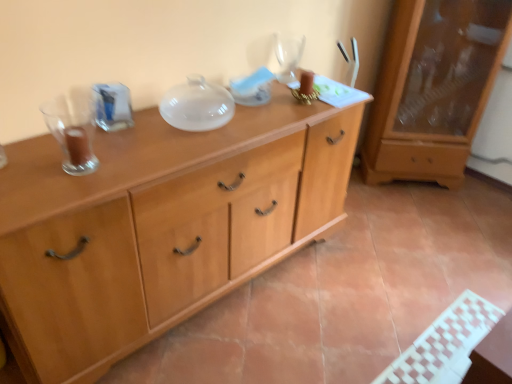
Question: From the image's perspective, would you say light wood cabinet at center is positioned over transparent glass wine glass at upper center?

Choices:
 (A) yes
 (B) no

Answer: (B)

Question: From a real-world perspective, is light wood cabinet at center physically below transparent glass wine glass at upper center?

Choices:
 (A) yes
 (B) no

Answer: (A)

Question: Is light wood cabinet at center positioned beyond the bounds of transparent glass wine glass at upper center?

Choices:
 (A) yes
 (B) no

Answer: (A)

Question: Is light wood cabinet at center thinner than transparent glass wine glass at upper center?

Choices:
 (A) yes
 (B) no

Answer: (B)

Question: From a real-world perspective, is light wood cabinet at center over transparent glass wine glass at upper center?

Choices:
 (A) yes
 (B) no

Answer: (B)

Question: Is light wood cabinet at center to the right of transparent glass wine glass at upper center from the viewer's perspective?

Choices:
 (A) yes
 (B) no

Answer: (B)

Question: Is matte wooden cabinet at right bigger than transparent glass wine glass at upper center?

Choices:
 (A) yes
 (B) no

Answer: (A)

Question: Does matte wooden cabinet at right appear on the right side of transparent glass wine glass at upper center?

Choices:
 (A) yes
 (B) no

Answer: (A)

Question: Is matte wooden cabinet at right closer to the viewer compared to transparent glass wine glass at upper center?

Choices:
 (A) no
 (B) yes

Answer: (A)

Question: Is matte wooden cabinet at right positioned behind transparent glass wine glass at upper center?

Choices:
 (A) no
 (B) yes

Answer: (B)

Question: From a real-world perspective, is matte wooden cabinet at right beneath transparent glass wine glass at upper center?

Choices:
 (A) yes
 (B) no

Answer: (A)

Question: Considering the relative sizes of matte wooden cabinet at right and transparent glass wine glass at upper center in the image provided, is matte wooden cabinet at right shorter than transparent glass wine glass at upper center?

Choices:
 (A) no
 (B) yes

Answer: (A)

Question: Is transparent glass wine glass at upper center positioned beyond the bounds of light wood cabinet at center?

Choices:
 (A) yes
 (B) no

Answer: (A)